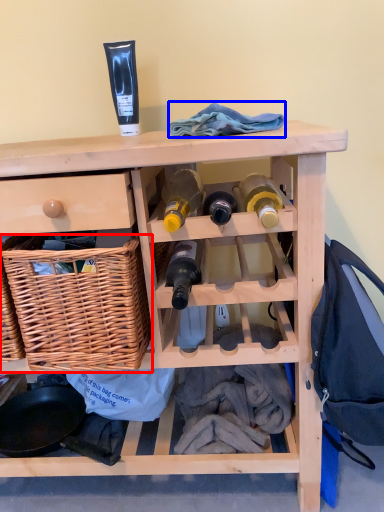
Question: Which object is further to the camera taking this photo, basket (highlighted by a red box) or clothing (highlighted by a blue box)?

Choices:
 (A) basket
 (B) clothing

Answer: (B)